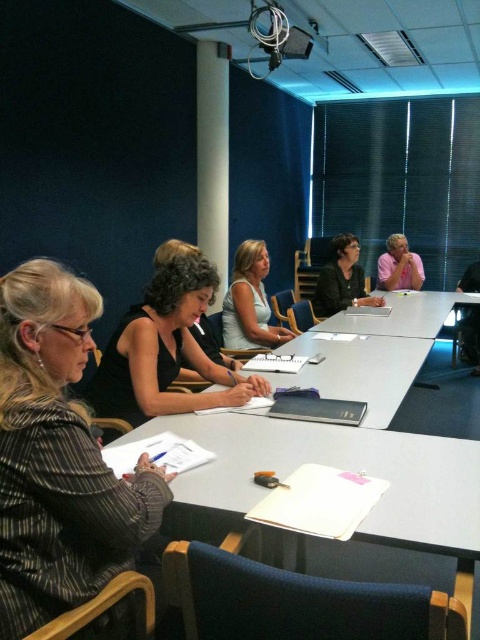
Who is positioned more to the right, white paper at center or white glossy table at center?

Positioned to the right is white glossy table at center.

What do you see at coordinates (335, 467) in the screenshot?
I see `white paper at center` at bounding box center [335, 467].

Is point (288, 465) more distant than point (407, 316)?

No, (288, 465) is closer to viewer.

You are a GUI agent. You are given a task and a screenshot of the screen. Output one action in this format:
    pyautogui.click(x=<x>, y=<y>)
    Task: Click on the white paper at center
    Image resolution: width=480 pixels, height=640 pixels.
    Given the screenshot: What is the action you would take?
    pyautogui.click(x=335, y=467)

Who is more forward, [308,385] or [331,284]?

Point [308,385] is more forward.

Find the location of a particular element. smooth gray table at center is located at coordinates (359, 371).

Between point (330, 396) and point (347, 237), which one is positioned behind?

The point (347, 237) is behind.

Find the location of a particular element. This screenshot has width=480, height=640. smooth gray table at center is located at coordinates (359, 371).

What do you see at coordinates (342, 280) in the screenshot? I see `black fabric jacket at center` at bounding box center [342, 280].

The width and height of the screenshot is (480, 640). I want to click on black fabric jacket at center, so click(342, 280).